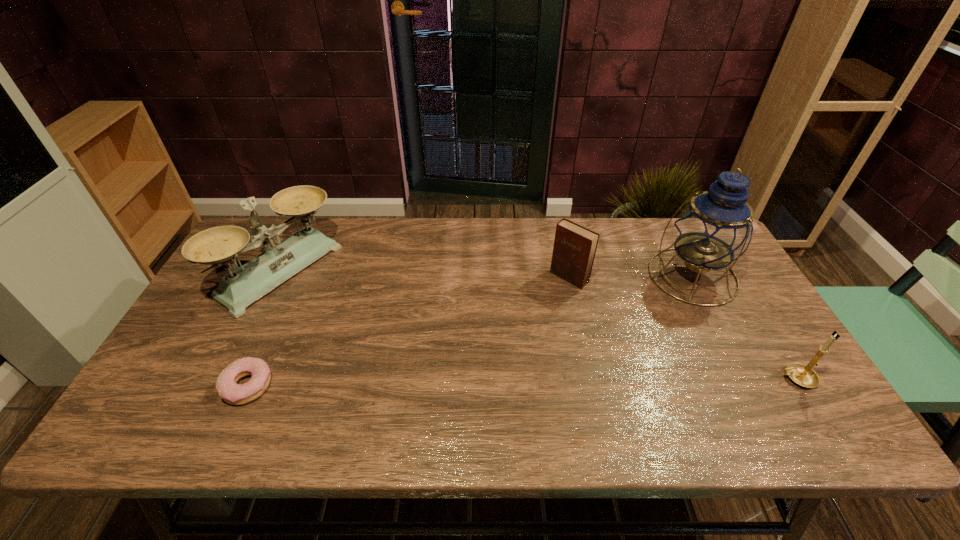
In the image, there is a desktop. In order to click on blank space at the near right corner in this screenshot , I will do coord(785,401).

This screenshot has height=540, width=960. I want to click on vacant point located between the candle holder and the lantern, so click(744, 327).

Where is `blank region between the doughnut and the lantern`? The width and height of the screenshot is (960, 540). blank region between the doughnut and the lantern is located at coordinates coord(469,330).

You are a GUI agent. You are given a task and a screenshot of the screen. Output one action in this format:
    pyautogui.click(x=<x>, y=<y>)
    Task: Click on the vacant space that is in between the third object from left to right and the candle holder
    This screenshot has width=960, height=540.
    Given the screenshot: What is the action you would take?
    pyautogui.click(x=683, y=328)

Locate an element on the screen. The image size is (960, 540). free space between the candle holder and the scale is located at coordinates (539, 325).

Where is `free space between the tallest object and the second tallest object`? This screenshot has width=960, height=540. free space between the tallest object and the second tallest object is located at coordinates (487, 274).

Identify the location of free space between the candle holder and the shortest object. (521, 382).

Locate an element on the screen. The height and width of the screenshot is (540, 960). free space between the third object from left to right and the candle holder is located at coordinates (683, 328).

Image resolution: width=960 pixels, height=540 pixels. I want to click on free space between the diary and the candle holder, so click(x=683, y=328).

You are a GUI agent. You are given a task and a screenshot of the screen. Output one action in this format:
    pyautogui.click(x=<x>, y=<y>)
    Task: Click on the free space between the tallest object and the doughnut
    Image resolution: width=960 pixels, height=540 pixels.
    Given the screenshot: What is the action you would take?
    pyautogui.click(x=469, y=330)